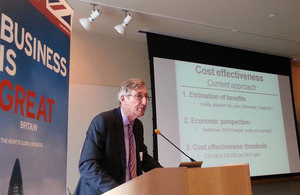
The height and width of the screenshot is (195, 300). In order to click on light fixtures in this screenshot , I will do `click(94, 18)`, `click(125, 22)`.